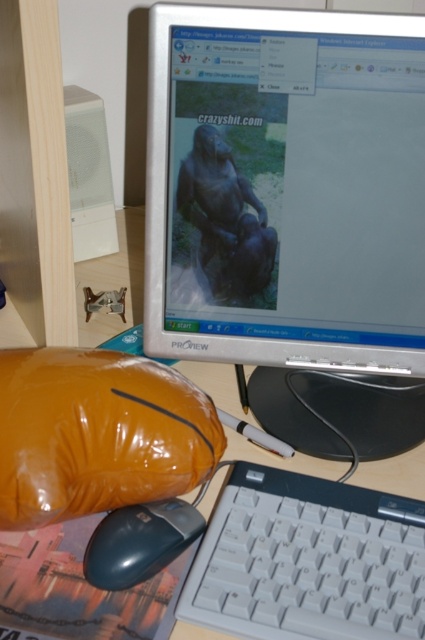
Question: Which point is farther to the camera?

Choices:
 (A) (176, 520)
 (B) (82, 493)

Answer: (A)

Question: Which point appears closest to the camera in this image?

Choices:
 (A) (266, 212)
 (B) (142, 504)

Answer: (B)

Question: Estimate the real-world distances between objects in this image. Which object is closer to the matte plastic monitor at center?

Choices:
 (A) orange fabric pillow at lower left
 (B) matte black mouse at lower left
 (C) white plastic keyboard at lower center

Answer: (A)

Question: Can you confirm if matte plastic monitor at center is wider than matte black mouse at lower left?

Choices:
 (A) yes
 (B) no

Answer: (A)

Question: Is white plastic computer desk at lower center thinner than matte black mouse at lower left?

Choices:
 (A) no
 (B) yes

Answer: (A)

Question: Is white plastic keyboard at lower center to the left of orange fabric pillow at lower left from the viewer's perspective?

Choices:
 (A) yes
 (B) no

Answer: (B)